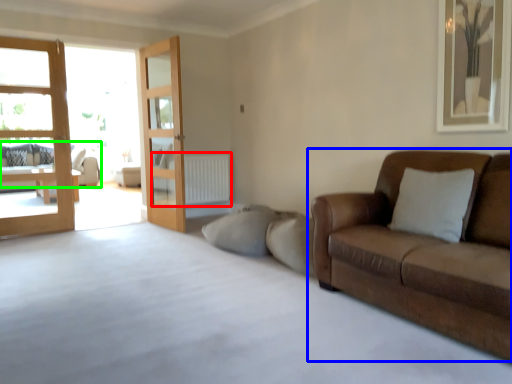
Question: Which object is the closest to the radiator (highlighted by a red box)? Choose among these: studio couch (highlighted by a blue box) or studio couch (highlighted by a green box).

Choices:
 (A) studio couch
 (B) studio couch

Answer: (B)